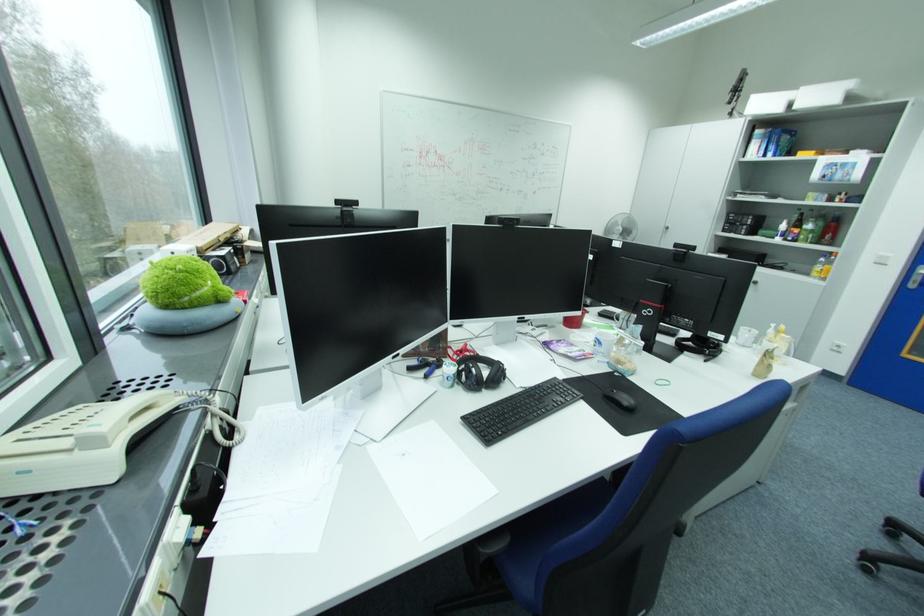
Locate an element on the screen. white printed mug is located at coordinates (746, 336).